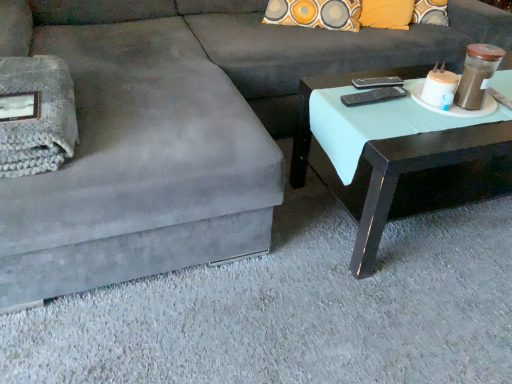
Question: Can you confirm if black plastic remote at upper right, which appears as the 2th remote when ordered from the bottom, is thinner than black plastic remote at upper right, the 1th remote in the front-to-back sequence?

Choices:
 (A) no
 (B) yes

Answer: (B)

Question: Does black plastic remote at upper right, which is the second remote in front-to-back order, have a smaller size compared to black plastic remote at upper right, the 1th remote in the front-to-back sequence?

Choices:
 (A) no
 (B) yes

Answer: (B)

Question: From the image's perspective, does black plastic remote at upper right, the first remote viewed from the back, appear lower than black plastic remote at upper right, the 1th remote from the bottom?

Choices:
 (A) yes
 (B) no

Answer: (B)

Question: From a real-world perspective, is black plastic remote at upper right, which appears as the 2th remote when ordered from the bottom, under black plastic remote at upper right, the 2th remote viewed from the back?

Choices:
 (A) no
 (B) yes

Answer: (B)

Question: Is black plastic remote at upper right, which appears as the 2th remote when ordered from the bottom, bigger than black plastic remote at upper right, which ranks as the 2th remote in top-to-bottom order?

Choices:
 (A) no
 (B) yes

Answer: (A)

Question: From a real-world perspective, is matte black coffee table at right positioned above or below black plastic remote at upper right, marked as the first remote in a top-to-bottom arrangement?

Choices:
 (A) below
 (B) above

Answer: (A)

Question: Considering the positions of matte black coffee table at right and black plastic remote at upper right, the first remote viewed from the back, in the image, is matte black coffee table at right taller or shorter than black plastic remote at upper right, the first remote viewed from the back,?

Choices:
 (A) short
 (B) tall

Answer: (B)

Question: Choose the correct answer: Is matte black coffee table at right inside black plastic remote at upper right, marked as the first remote in a top-to-bottom arrangement, or outside it?

Choices:
 (A) inside
 (B) outside

Answer: (B)

Question: Considering the positions of point (446, 147) and point (378, 82), is point (446, 147) closer or farther from the camera than point (378, 82)?

Choices:
 (A) farther
 (B) closer

Answer: (B)

Question: From a real-world perspective, is matte black coffee table at right above or below black plastic remote at upper right, the 1th remote from the bottom?

Choices:
 (A) above
 (B) below

Answer: (B)

Question: Is matte black coffee table at right to the left or to the right of black plastic remote at upper right, the 1th remote from the bottom, in the image?

Choices:
 (A) left
 (B) right

Answer: (B)

Question: Is matte black coffee table at right taller or shorter than black plastic remote at upper right, the 1th remote from the bottom?

Choices:
 (A) tall
 (B) short

Answer: (A)

Question: Looking at the image, does matte black coffee table at right seem bigger or smaller compared to black plastic remote at upper right, the 1th remote from the bottom?

Choices:
 (A) big
 (B) small

Answer: (A)

Question: Is black plastic remote at upper right, the 1th remote from the bottom, situated inside matte black coffee table at right or outside?

Choices:
 (A) inside
 (B) outside

Answer: (B)

Question: Is black plastic remote at upper right, which ranks as the 2th remote in top-to-bottom order, taller or shorter than matte black coffee table at right?

Choices:
 (A) short
 (B) tall

Answer: (A)